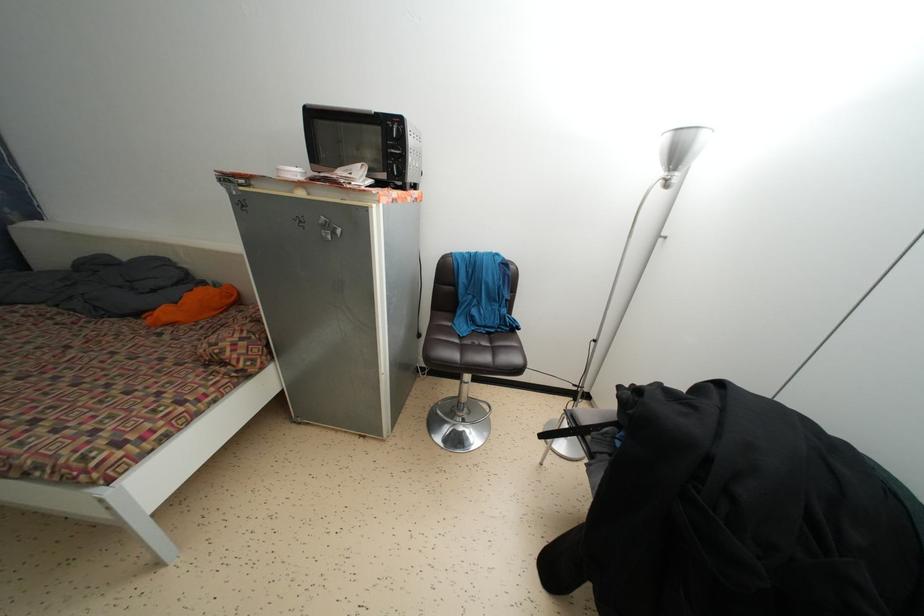
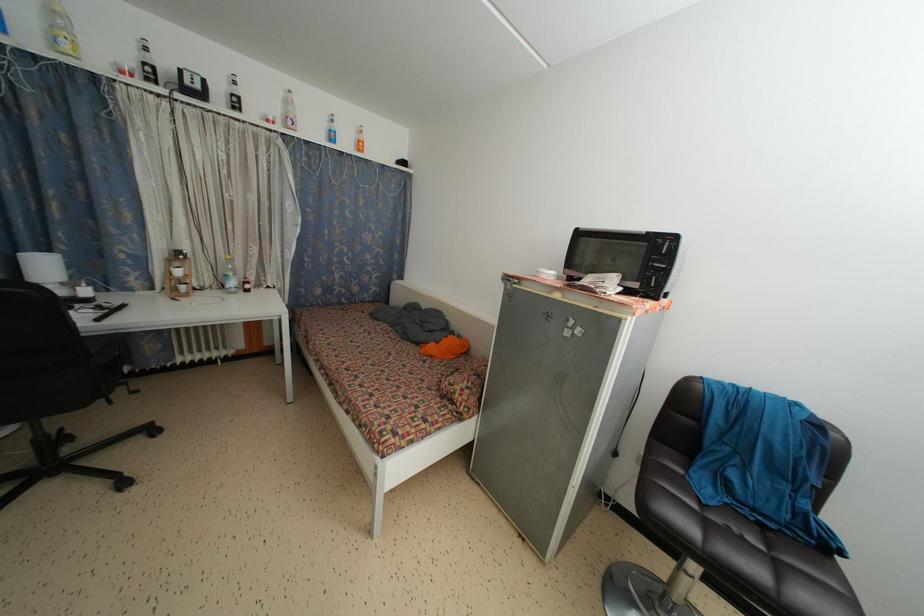
The point at (407,167) is marked in the first image. Where is the corresponding point in the second image?

(669, 280)